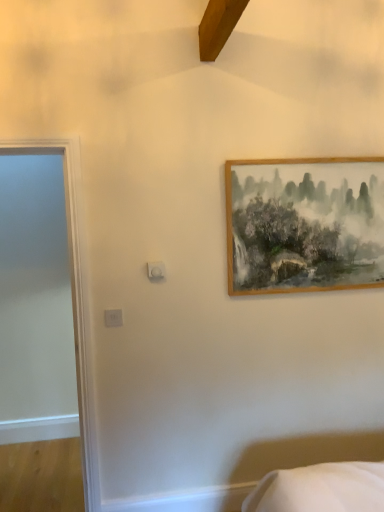
Find the location of a particular element. free location above wooden frame at upper right (from a real-world perspective) is located at coordinates (317, 156).